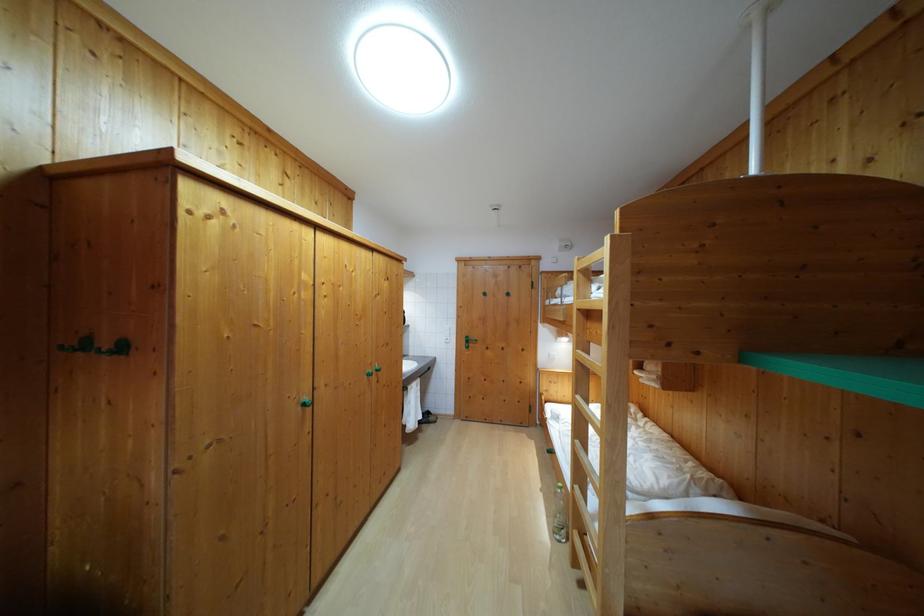
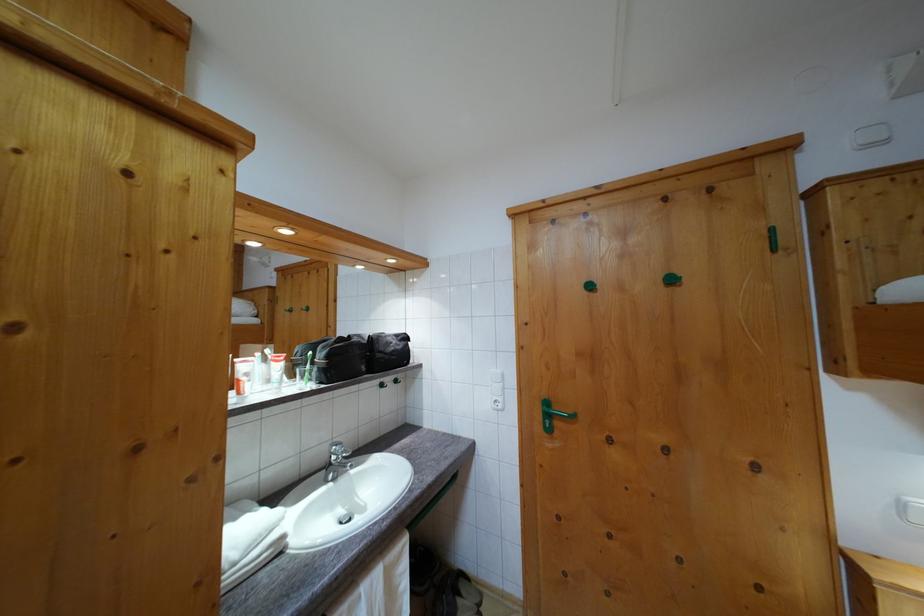
Question: In a continuous first-person perspective shot, in which direction is the camera moving?

Choices:
 (A) Left
 (B) Right
 (C) Forward
 (D) Backward

Answer: (C)